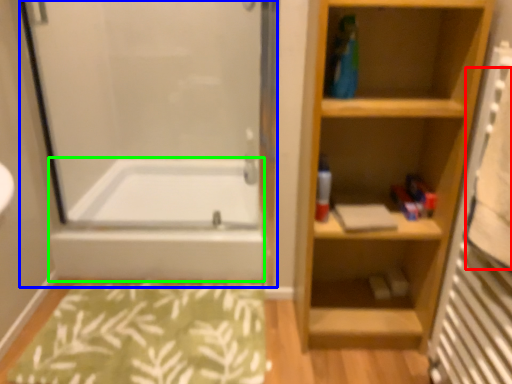
Question: Based on their relative distances, which object is nearer to bath towel (highlighted by a red box)? Choose from screen door (highlighted by a blue box) and bathtub (highlighted by a green box).

Choices:
 (A) screen door
 (B) bathtub

Answer: (B)